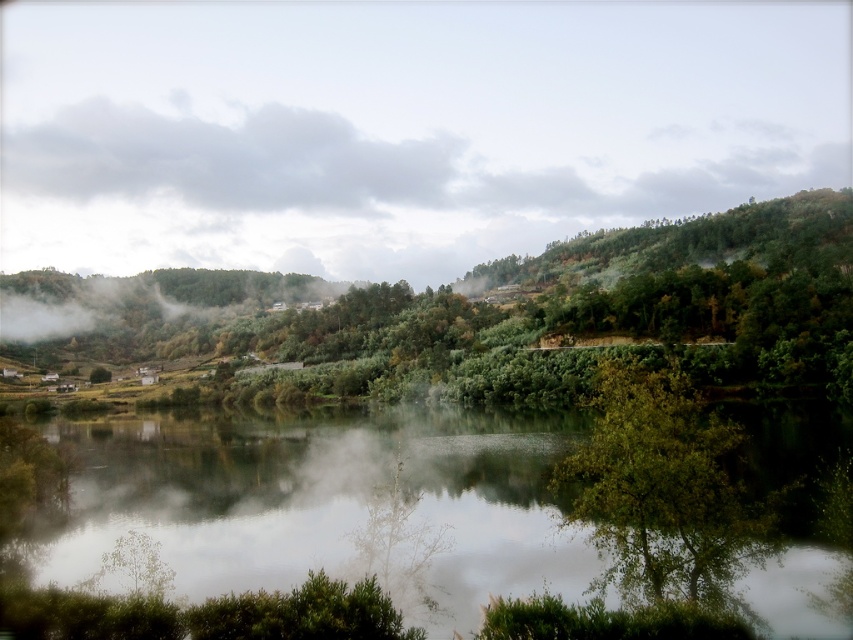
The height and width of the screenshot is (640, 853). What do you see at coordinates (398, 129) in the screenshot? I see `white misty fog at center` at bounding box center [398, 129].

Between white misty fog at center and green leafy tree at lower right, which one has more height?

white misty fog at center

Is point (271, 188) positioned in front of point (717, 508)?

No, (271, 188) is behind (717, 508).

I want to click on white misty fog at center, so click(x=398, y=129).

Can you confirm if white misty fog at center is positioned to the right of green reflective water at center?

Incorrect, white misty fog at center is not on the right side of green reflective water at center.

Who is more distant from viewer, (325,260) or (468,595)?

Positioned behind is point (325,260).

Is point (16, 260) positioned before point (26, 545)?

No, it is not.

The height and width of the screenshot is (640, 853). Identify the location of white misty fog at center. 398,129.

Between green reflective water at center and green leafy tree at lower right, which one is positioned higher?

Positioned higher is green leafy tree at lower right.

Can you confirm if green reflective water at center is bigger than green leafy tree at lower right?

Yes, green reflective water at center is bigger than green leafy tree at lower right.

Which is behind, point (764, 572) or point (694, 413)?

The point (694, 413) is behind.

I want to click on green reflective water at center, so click(x=329, y=502).